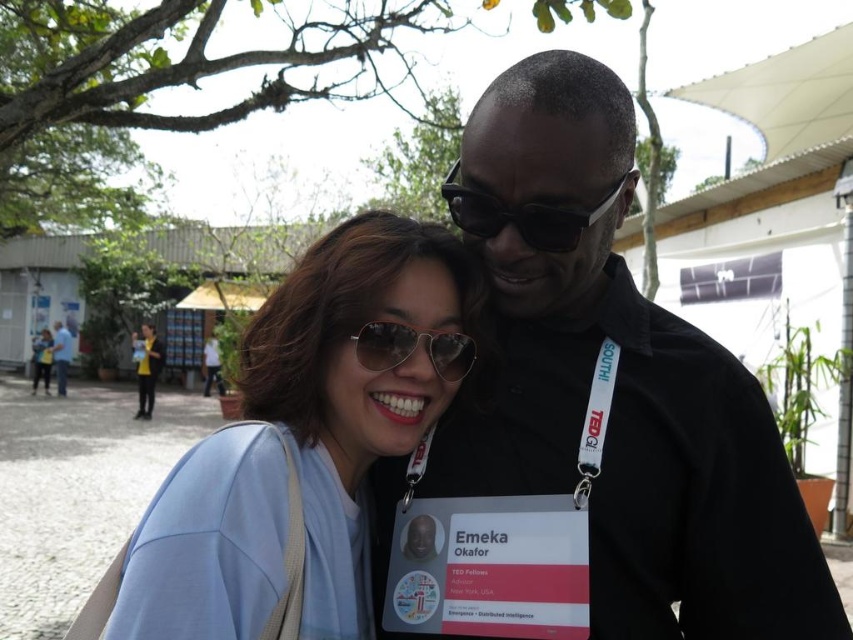
Which of these two, black matte shirt at upper right or blue shirt at left, stands shorter?

black matte shirt at upper right is shorter.

Does black matte shirt at upper right have a lesser width compared to blue shirt at left?

Correct, black matte shirt at upper right's width is less than blue shirt at left's.

Between point (527, 364) and point (65, 336), which one is positioned behind?

The point (65, 336) is more distant.

Locate an element on the screen. black matte shirt at upper right is located at coordinates (643, 454).

Is point (515, 225) farther from camera compared to point (67, 337)?

No, (515, 225) is closer to viewer.

Can you confirm if black plastic sunglasses at upper center is thinner than blue shirt at left?

Indeed, black plastic sunglasses at upper center has a lesser width compared to blue shirt at left.

You are a GUI agent. You are given a task and a screenshot of the screen. Output one action in this format:
    pyautogui.click(x=<x>, y=<y>)
    Task: Click on the black plastic sunglasses at upper center
    The image size is (853, 640).
    Given the screenshot: What is the action you would take?
    pyautogui.click(x=523, y=216)

Which is in front, point (753, 486) or point (370, 346)?

Positioned in front is point (753, 486).

Can you confirm if black matte shirt at upper right is positioned above metallic reflective goggles at center?

Actually, black matte shirt at upper right is below metallic reflective goggles at center.

The height and width of the screenshot is (640, 853). I want to click on black matte shirt at upper right, so click(643, 454).